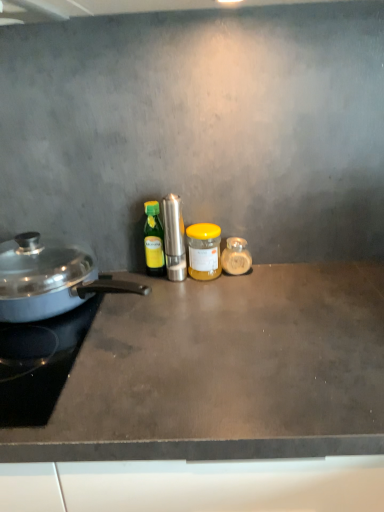
This screenshot has width=384, height=512. What are the coordinates of `vacant space that is to the left of polished stainless steel grinder at center, which ranks as the 3th kitchen appliance in right-to-left order` in the screenshot? It's located at (119, 292).